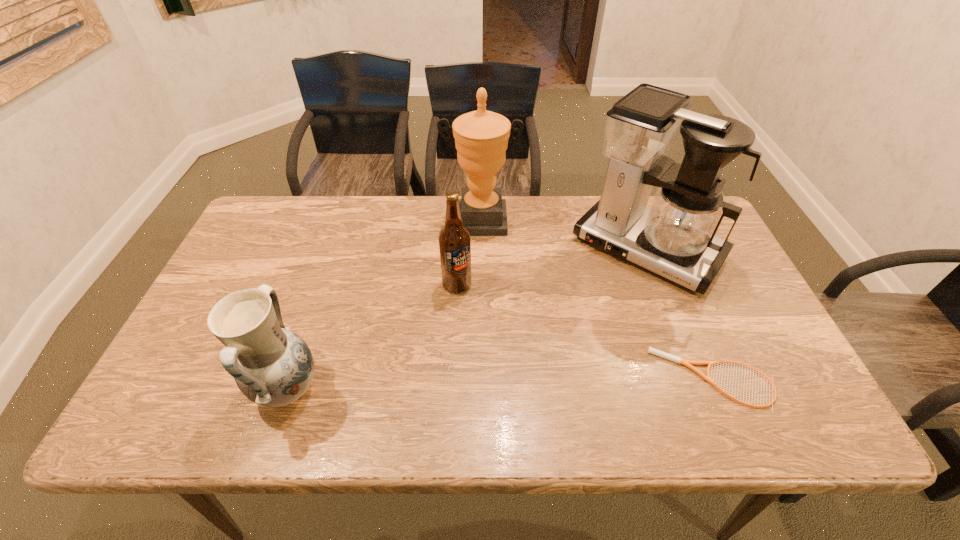
Locate an element on the screen. Image resolution: width=960 pixels, height=540 pixels. the leftmost object is located at coordinates (272, 366).

Locate an element on the screen. the shortest object is located at coordinates (687, 363).

This screenshot has width=960, height=540. Find the location of `award`. award is located at coordinates (481, 137).

I want to click on beer bottle, so click(454, 238).

At what (x,y) coordinates should I click in order to perform the action: click on coffee maker. Please return your answer as a coordinate pair (x, y). Image resolution: width=960 pixels, height=540 pixels. Looking at the image, I should click on (675, 238).

You are a GUI agent. You are given a task and a screenshot of the screen. Output one action in this format:
    pyautogui.click(x=<x>, y=<y>)
    Task: Click on the vacant area located on either side of the leftmost object
    This screenshot has width=960, height=540.
    Given the screenshot: What is the action you would take?
    pyautogui.click(x=446, y=389)

This screenshot has height=540, width=960. Find the location of `free location located 0.350m on the left of the tennis racket`. free location located 0.350m on the left of the tennis racket is located at coordinates (501, 380).

What are the coordinates of `free space located 0.390m at the front of the award with handles` in the screenshot? It's located at (481, 340).

I want to click on vacant area situated 0.140m at the front of the award with handles, so click(481, 268).

The image size is (960, 540). What are the coordinates of `vacant space located 0.270m at the front of the award with handles` in the screenshot? It's located at (481, 303).